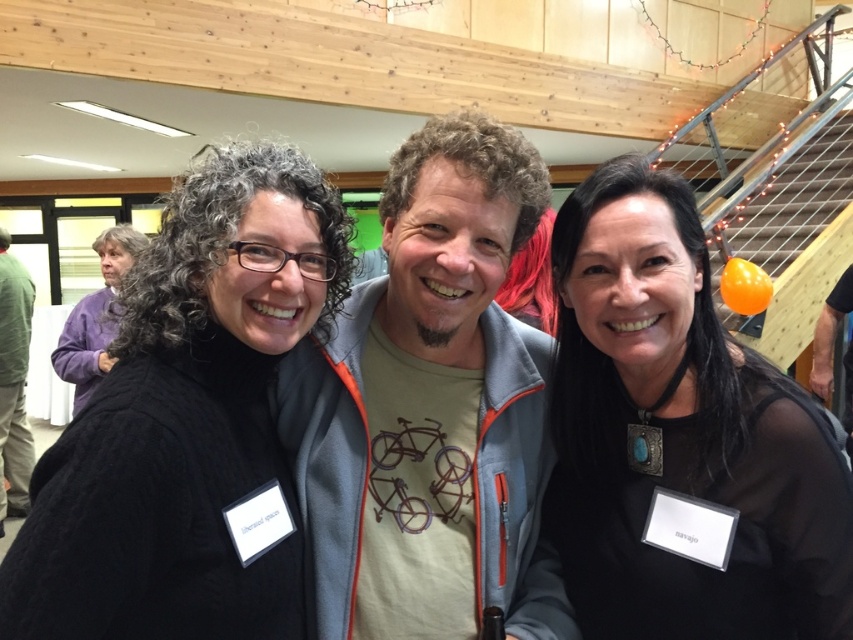
You are organizing a clothing donation drive and need to categorize items by size. You have two shirts here, the black mesh top at right and the green cotton shirt at left. Which shirt should be placed in the large size bin?

The green cotton shirt at left should be placed in the large size bin because the black mesh top at right has a smaller size compared to it.